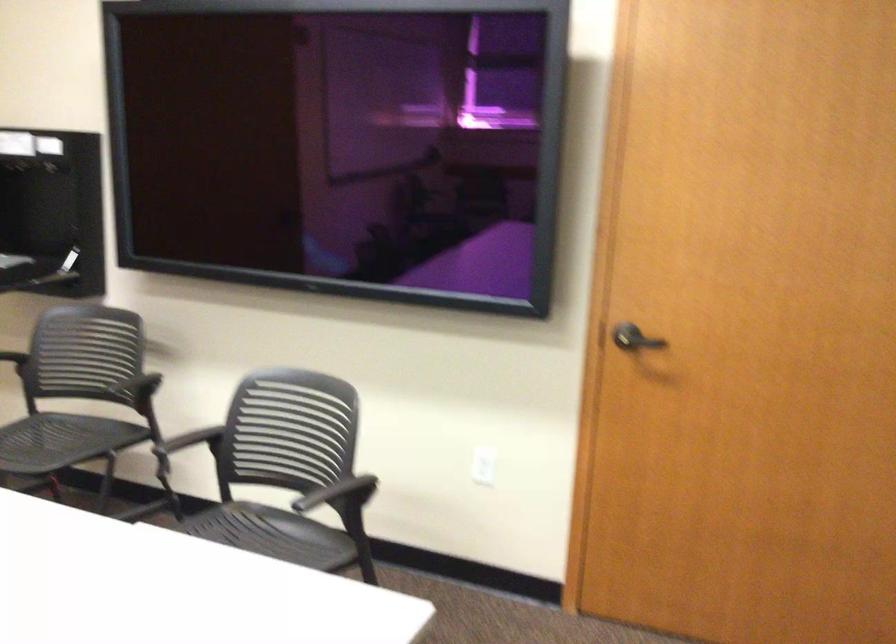
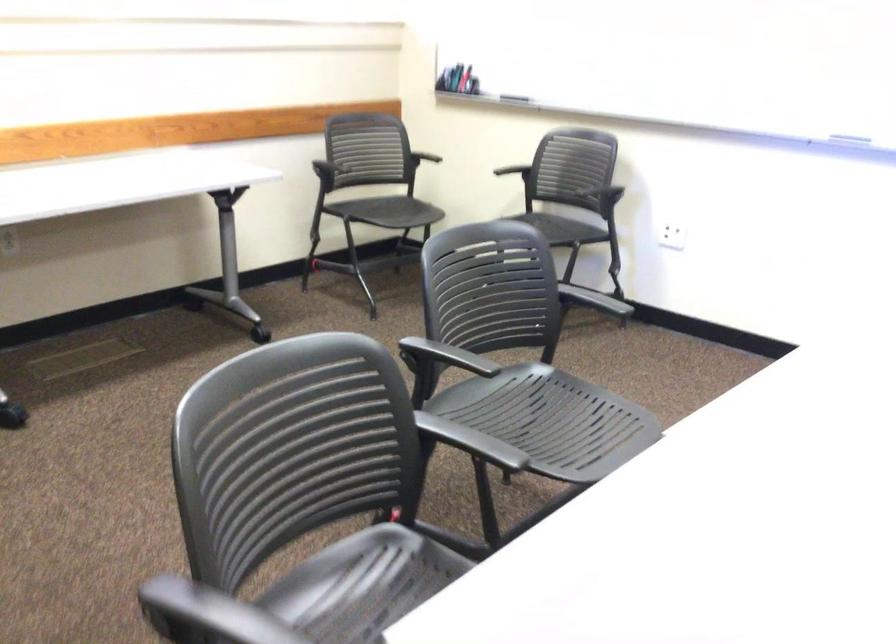
The images are taken continuously from a first-person perspective. In which direction is your viewpoint rotating?

The camera's rotation is toward left-down.